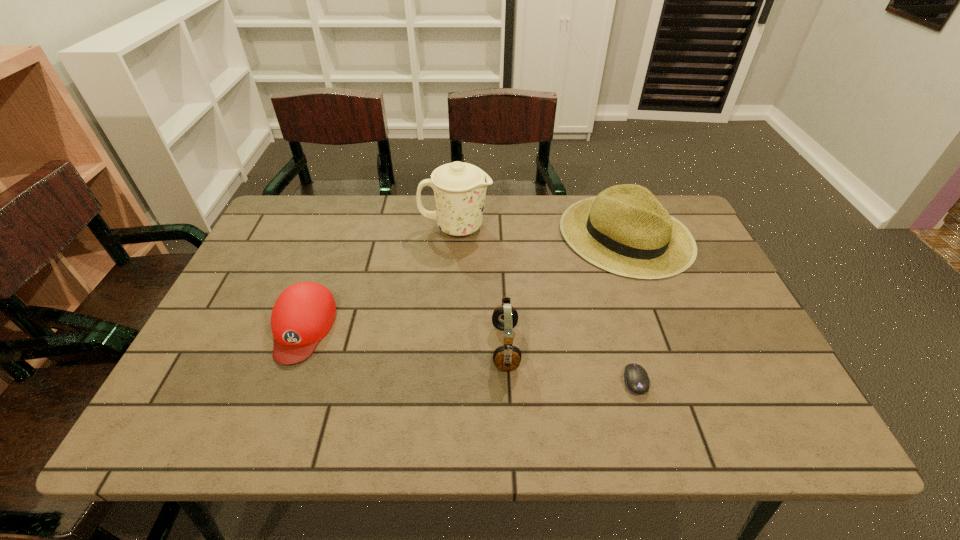
Image resolution: width=960 pixels, height=540 pixels. Find the location of `the tallest object`. the tallest object is located at coordinates (459, 188).

Locate an element on the screen. This screenshot has width=960, height=540. sunhat is located at coordinates (625, 230).

The image size is (960, 540). Find the location of `headset`. headset is located at coordinates (505, 317).

You are a GUI agent. You are given a task and a screenshot of the screen. Output one action in this format:
    pyautogui.click(x=<x>, y=<y>)
    Task: Click on the second shortest object
    The width and height of the screenshot is (960, 540).
    Given the screenshot: What is the action you would take?
    pyautogui.click(x=304, y=312)

This screenshot has width=960, height=540. I want to click on the leftmost object, so click(304, 312).

Identify the location of computer mouse. (637, 381).

Identify the location of vacant space situated on the spout of the chinaware. (528, 227).

Find the location of a particular element. This screenshot has height=540, width=960. vacant region located 0.090m on the front of the sunhat is located at coordinates (653, 305).

At what (x,y) coordinates should I click in order to perform the action: click on blank space located on the ear cups of the headset. Please return your answer as a coordinate pair (x, y). Looking at the image, I should click on tap(319, 347).

This screenshot has width=960, height=540. What are the coordinates of `free space located on the ear cups of the headset` in the screenshot? It's located at (388, 347).